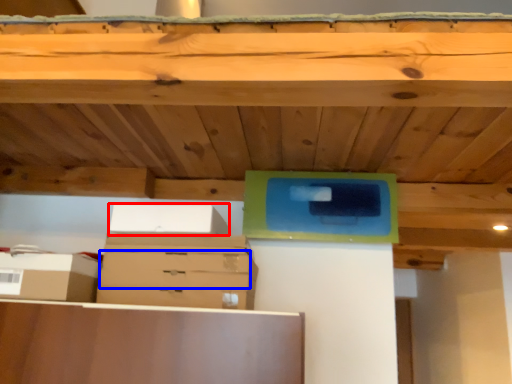
Question: Which object appears closest to the camera in this image, storage box (highlighted by a red box) or drawer (highlighted by a blue box)?

Choices:
 (A) storage box
 (B) drawer

Answer: (A)